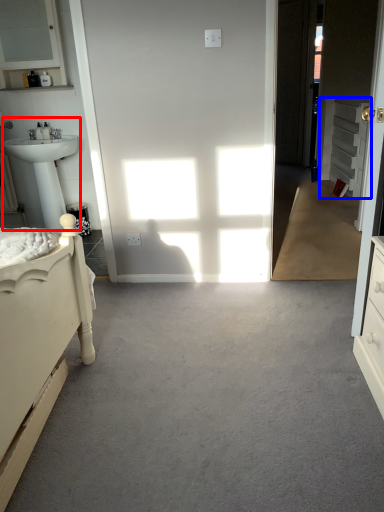
Question: Which object is further to the camera taking this photo, sink (highlighted by a red box) or cabinetry (highlighted by a blue box)?

Choices:
 (A) sink
 (B) cabinetry

Answer: (B)